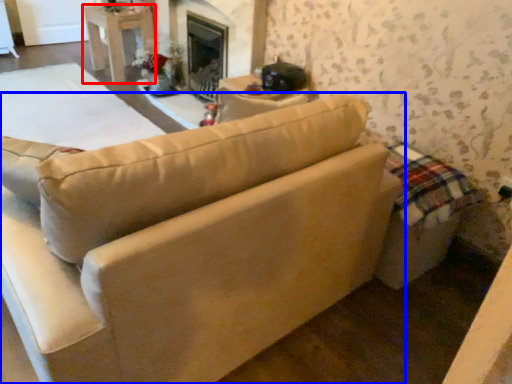
Question: Which object appears farthest to the camera in this image, table (highlighted by a red box) or studio couch (highlighted by a blue box)?

Choices:
 (A) table
 (B) studio couch

Answer: (A)